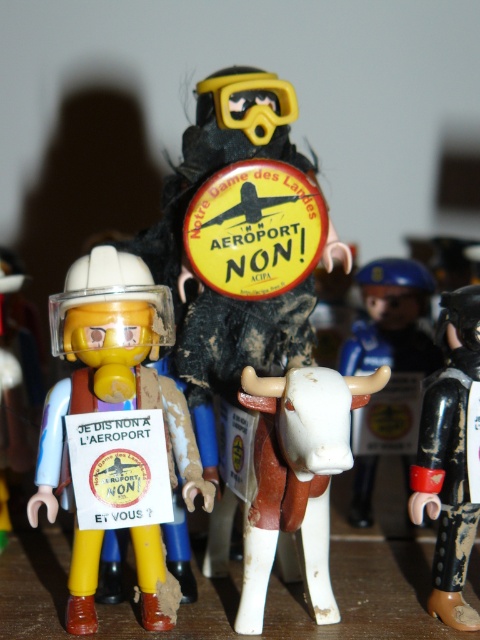
From the picture: Does white matte bull at center appear on the left side of black matte figure at right?

Yes, white matte bull at center is to the left of black matte figure at right.

Which is in front, point (327, 384) or point (463, 433)?

Point (327, 384) is in front.

The image size is (480, 640). I want to click on white matte bull at center, so click(x=297, y=476).

Does matte black figure at center come behind black matte figure at right?

Yes, it is.

Is matte black figure at center to the right of black matte figure at right from the viewer's perspective?

In fact, matte black figure at center is to the left of black matte figure at right.

Between point (264, 340) and point (462, 296), which one is positioned in front?

Point (462, 296) is more forward.

This screenshot has width=480, height=640. I want to click on matte black figure at center, so click(192, 260).

Is point (444, 416) positioned behind point (254, 125)?

That is False.

Can you confirm if black matte figure at right is bigger than yellow matte goggles at upper center?

Yes, black matte figure at right is bigger than yellow matte goggles at upper center.

Who is more distant from viewer, [467,364] or [276,84]?

The point [276,84] is more distant.

Find the location of `black matte figure at right`. black matte figure at right is located at coordinates (450, 461).